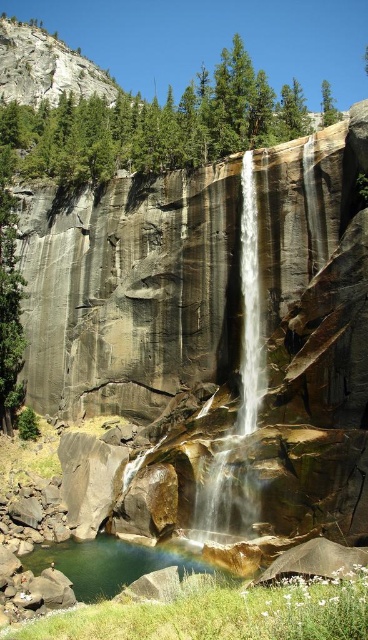
Question: Which point is farther to the camera?

Choices:
 (A) white smooth waterfall at center
 (B) clear water at lower center

Answer: (A)

Question: Is white smooth waterfall at center bigger than clear water at lower center?

Choices:
 (A) yes
 (B) no

Answer: (A)

Question: Which point is farther from the camera taking this photo?

Choices:
 (A) (263, 353)
 (B) (203, 564)

Answer: (A)

Question: Does white smooth waterfall at center have a smaller size compared to clear water at lower center?

Choices:
 (A) yes
 (B) no

Answer: (B)

Question: Among these points, which one is farthest from the camera?

Choices:
 (A) click(248, 364)
 (B) click(98, 572)

Answer: (A)

Question: Is white smooth waterfall at center to the right of clear water at lower center from the viewer's perspective?

Choices:
 (A) no
 (B) yes

Answer: (B)